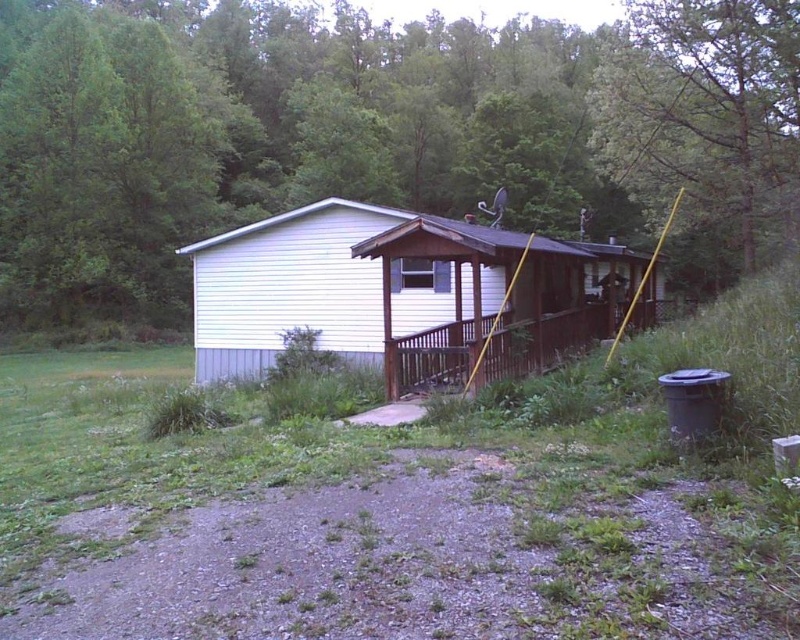
Question: Is green leafy tree at upper center closer to camera compared to white siding cabin at center?

Choices:
 (A) yes
 (B) no

Answer: (B)

Question: Which point is closer to the camera?

Choices:
 (A) (532, 284)
 (B) (230, 3)
 (C) (713, 0)

Answer: (A)

Question: Which object appears closest to the camera in this image?

Choices:
 (A) white siding cabin at center
 (B) green leafy tree at upper center
 (C) green leafy tree at upper right

Answer: (A)

Question: Which point appears closest to the camera in this image?

Choices:
 (A) (81, 12)
 (B) (717, 44)
 (C) (426, 369)

Answer: (C)

Question: Can you confirm if green leafy tree at upper center is thinner than white siding cabin at center?

Choices:
 (A) yes
 (B) no

Answer: (B)

Question: Does green leafy tree at upper center have a lesser width compared to green leafy tree at upper right?

Choices:
 (A) no
 (B) yes

Answer: (A)